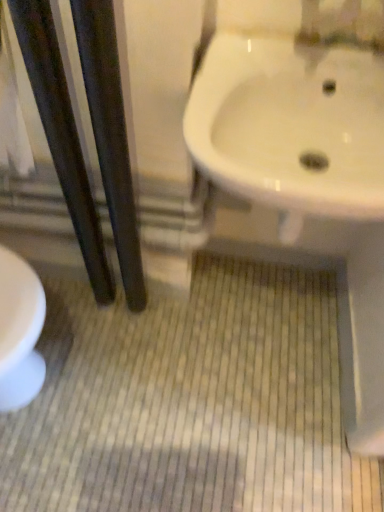
Question: Are black glossy poles at left, the 1th pole viewed from the right, and white glossy sink at upper right making contact?

Choices:
 (A) no
 (B) yes

Answer: (A)

Question: Can you confirm if black glossy poles at left, which appears as the second pole when viewed from the left, is positioned to the left of white glossy sink at upper right?

Choices:
 (A) no
 (B) yes

Answer: (B)

Question: Is black glossy poles at left, which appears as the second pole when viewed from the left, positioned before white glossy sink at upper right?

Choices:
 (A) yes
 (B) no

Answer: (A)

Question: Is black glossy poles at left, which appears as the second pole when viewed from the left, bigger than white glossy sink at upper right?

Choices:
 (A) yes
 (B) no

Answer: (B)

Question: Is black glossy poles at left, the 1th pole viewed from the right, surrounding white glossy sink at upper right?

Choices:
 (A) no
 (B) yes

Answer: (A)

Question: Does black glossy poles at left, which appears as the second pole when viewed from the left, appear on the right side of white glossy sink at upper right?

Choices:
 (A) yes
 (B) no

Answer: (B)

Question: Is white glossy sink at upper right outside of black glossy poles at left, the 1th pole viewed from the right?

Choices:
 (A) yes
 (B) no

Answer: (A)

Question: Is white glossy sink at upper right to the right of black glossy poles at left, which appears as the second pole when viewed from the left, from the viewer's perspective?

Choices:
 (A) no
 (B) yes

Answer: (B)

Question: Is white glossy sink at upper right turned away from black glossy poles at left, the 1th pole viewed from the right?

Choices:
 (A) yes
 (B) no

Answer: (B)

Question: Does white glossy sink at upper right have a larger size compared to black glossy poles at left, the 1th pole viewed from the right?

Choices:
 (A) yes
 (B) no

Answer: (A)

Question: Is white glossy sink at upper right not close to black glossy poles at left, the 1th pole viewed from the right?

Choices:
 (A) no
 (B) yes

Answer: (A)

Question: Is white glossy sink at upper right positioned before black glossy poles at left, the 1th pole viewed from the right?

Choices:
 (A) no
 (B) yes

Answer: (A)

Question: Considering the relative positions of dark wood pole at left, marked as the first pole in a left-to-right arrangement, and white glossy sink at upper right in the image provided, is dark wood pole at left, marked as the first pole in a left-to-right arrangement, to the left of white glossy sink at upper right from the viewer's perspective?

Choices:
 (A) no
 (B) yes

Answer: (B)